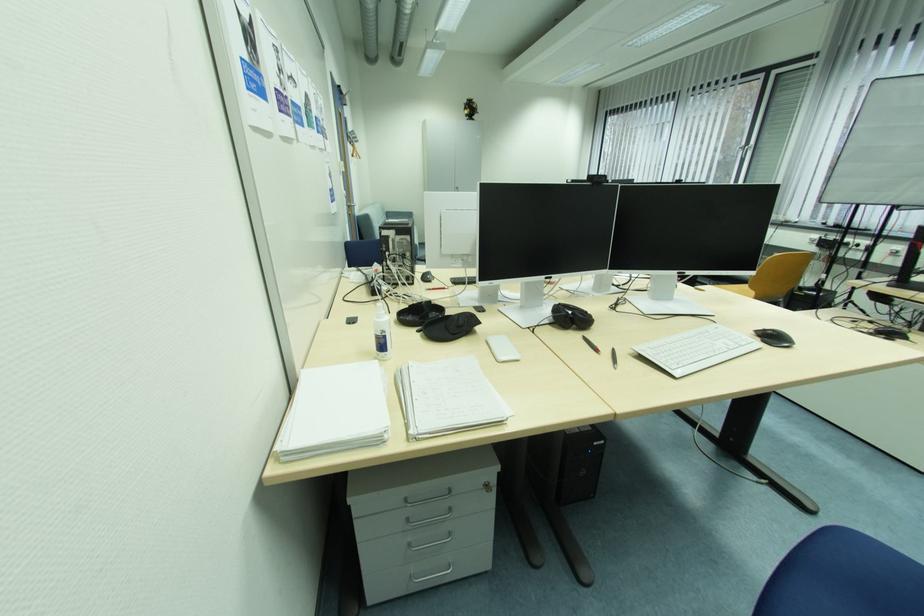
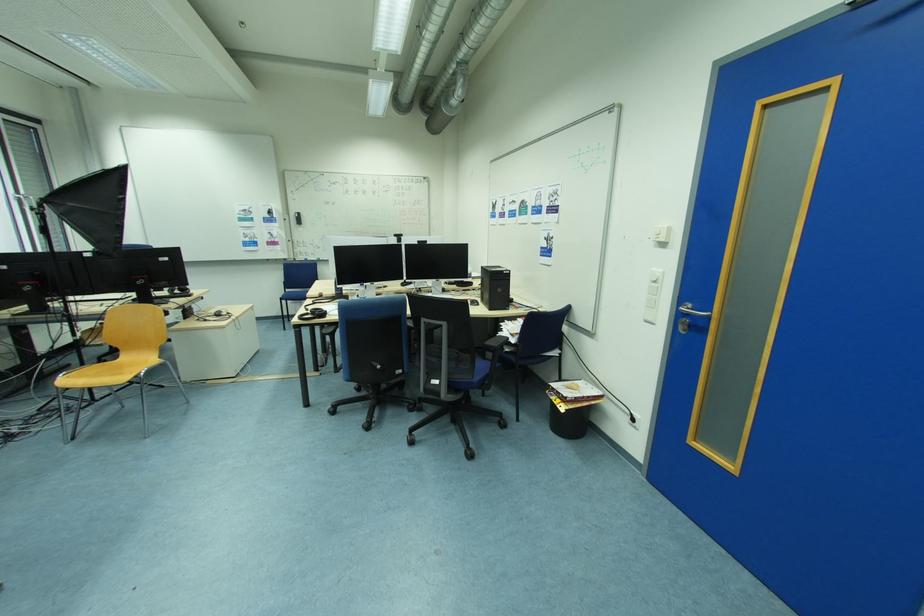
Question: I am providing you with two images of the same scene from different viewpoints. Which of the following objects are not visible in image2?

Choices:
 (A) spiral notebook
 (B) paper leaflet
 (C) silver door handle
 (D) black headphones

Answer: (A)